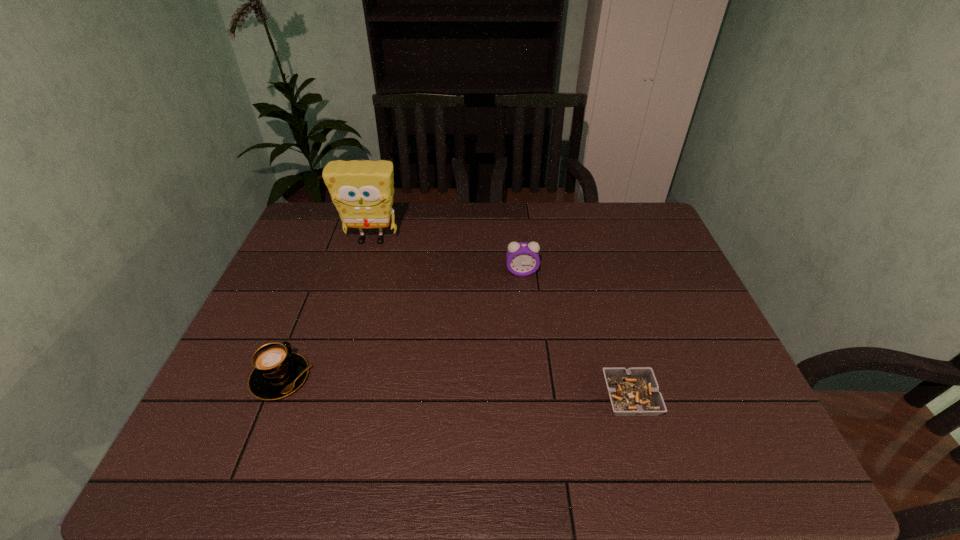
Image resolution: width=960 pixels, height=540 pixels. Identify the location of the second closest object to the shortest object. (277, 373).

The height and width of the screenshot is (540, 960). Identify the location of the closest object relative to the second farthest object. (362, 191).

Identify the location of vacant space that satisfies the following two spatial constraints: 1. on the face of the shortest object; 2. on the right side of the tallest object. This screenshot has height=540, width=960. (324, 397).

At what (x,y) coordinates should I click in order to perform the action: click on vacant region that satisfies the following two spatial constraints: 1. on the face of the alarm clock; 2. on the left side of the rightmost object. Please return your answer as a coordinate pair (x, y). This screenshot has height=540, width=960. Looking at the image, I should click on (535, 397).

At what (x,y) coordinates should I click in order to perform the action: click on vacant position in the image that satisfies the following two spatial constraints: 1. on the face of the rightmost object; 2. on the right side of the tallest object. Please return your answer as a coordinate pair (x, y). Looking at the image, I should click on (324, 397).